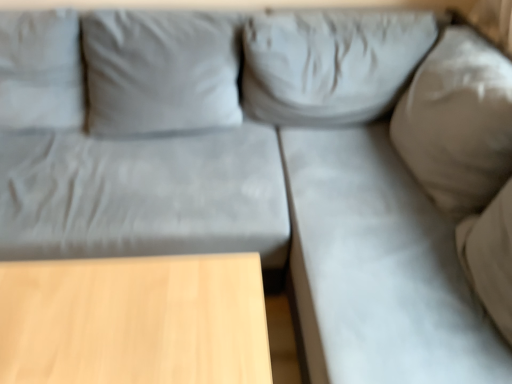
Question: Would you say light wood table at lower left is inside or outside gray fabric couch at right?

Choices:
 (A) outside
 (B) inside

Answer: (A)

Question: Is point (112, 369) closer or farther from the camera than point (441, 326)?

Choices:
 (A) farther
 (B) closer

Answer: (B)

Question: From a real-world perspective, relative to gray fabric couch at right, is light wood table at lower left vertically above or below?

Choices:
 (A) above
 (B) below

Answer: (B)

Question: Considering the positions of gray fabric couch at right and light wood table at lower left in the image, is gray fabric couch at right taller or shorter than light wood table at lower left?

Choices:
 (A) tall
 (B) short

Answer: (A)

Question: Based on their sizes in the image, would you say gray fabric couch at right is bigger or smaller than light wood table at lower left?

Choices:
 (A) small
 (B) big

Answer: (B)

Question: From the image's perspective, is gray fabric couch at right above or below light wood table at lower left?

Choices:
 (A) above
 (B) below

Answer: (A)

Question: Is gray fabric couch at right situated inside light wood table at lower left or outside?

Choices:
 (A) outside
 (B) inside

Answer: (A)